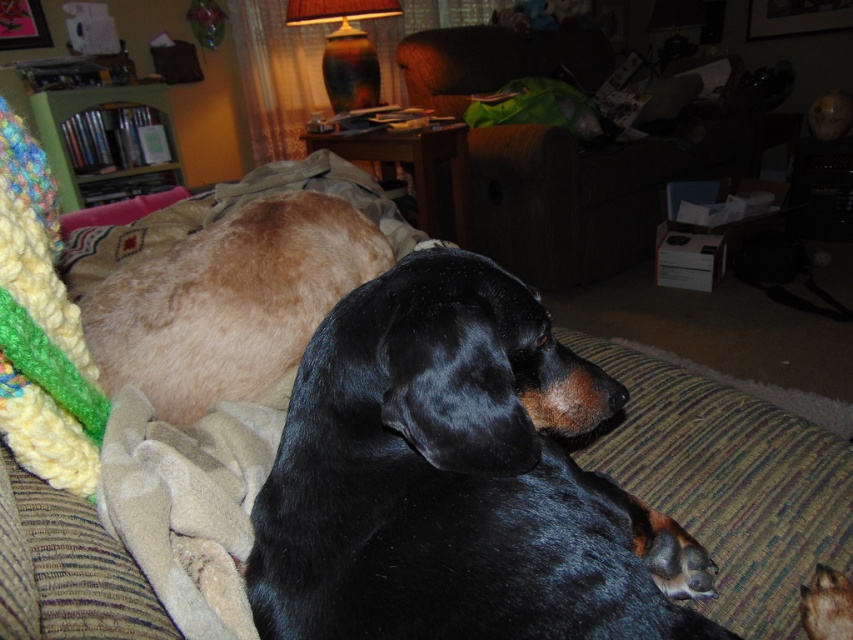
Question: Which of the following is the closest to the observer?

Choices:
 (A) brown wood armchair at center
 (B) black smooth dog at center

Answer: (B)

Question: Can you confirm if brown wood armchair at center is positioned to the left of golden fur dachshund at left?

Choices:
 (A) yes
 (B) no

Answer: (B)

Question: Which point is farther from the camera taking this photo?

Choices:
 (A) (202, 285)
 (B) (463, 51)

Answer: (B)

Question: Considering the real-world distances, which object is farthest from the black smooth dog at center?

Choices:
 (A) brown wood armchair at center
 (B) golden fur dachshund at left

Answer: (A)

Question: Does black smooth dog at center appear on the left side of brown wood armchair at center?

Choices:
 (A) no
 (B) yes

Answer: (B)

Question: Is black smooth dog at center thinner than golden fur dachshund at left?

Choices:
 (A) yes
 (B) no

Answer: (A)